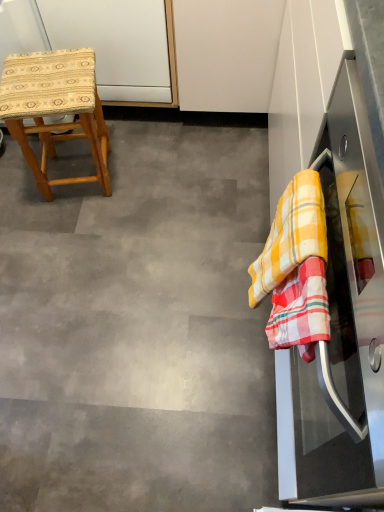
Question: From the image's perspective, relative to stainless steel oven at right, is wooden woven stool at left above or below?

Choices:
 (A) above
 (B) below

Answer: (A)

Question: Is wooden woven stool at left taller or shorter than stainless steel oven at right?

Choices:
 (A) short
 (B) tall

Answer: (A)

Question: Which object is positioned closest to the stainless steel oven at right?

Choices:
 (A) yellow checkered cloth at right
 (B) wooden woven stool at left
 (C) gray matte floor at center

Answer: (A)

Question: Estimate the real-world distances between objects in this image. Which object is farther from the gray matte floor at center?

Choices:
 (A) stainless steel oven at right
 (B) wooden woven stool at left
 (C) yellow checkered cloth at right

Answer: (C)